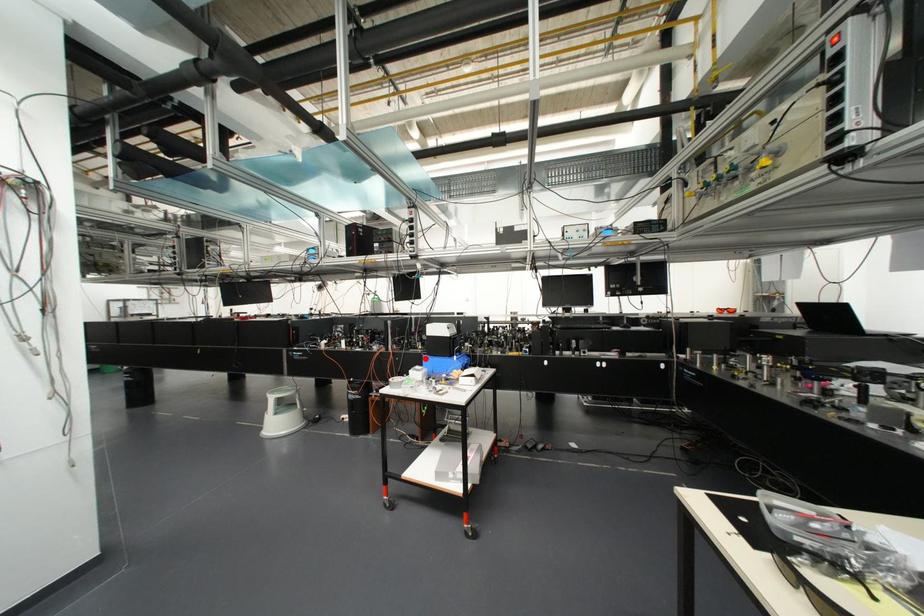
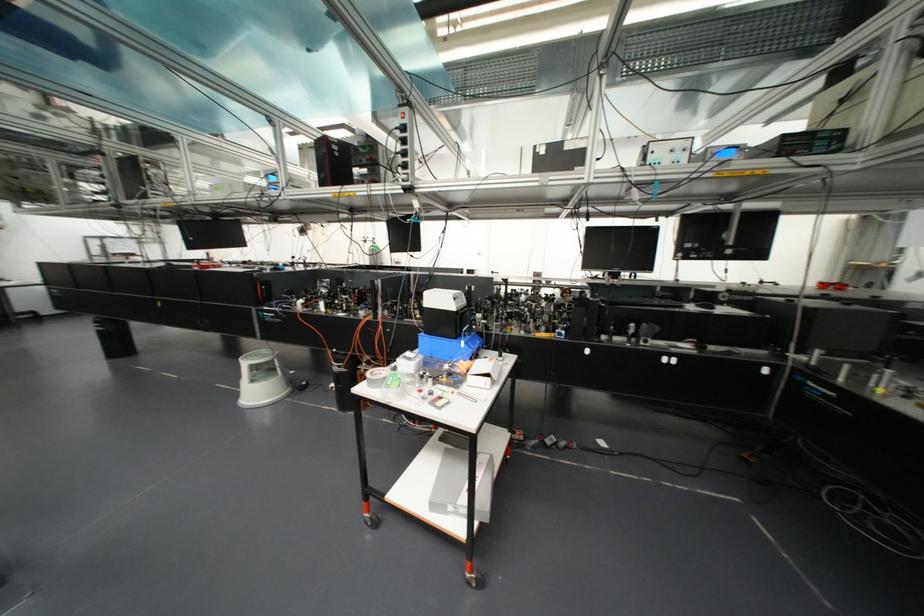
Question: A red point is marked in image1. In image2, is the corresponding 3D point closer to the camera or farther? Reply with the corresponding letter.

Choices:
 (A) The corresponding 3D point is closer.
 (B) The corresponding 3D point is farther.

Answer: (A)